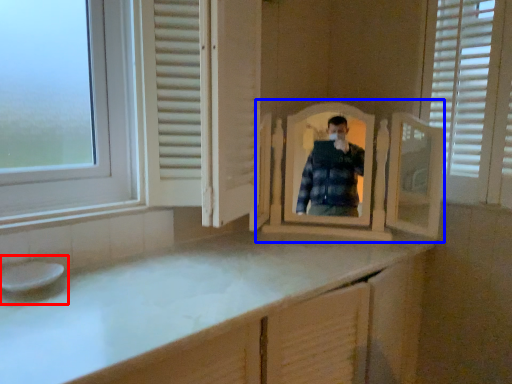
Question: Among these objects, which one is farthest to the camera, sink (highlighted by a red box) or mirror (highlighted by a blue box)?

Choices:
 (A) sink
 (B) mirror

Answer: (B)